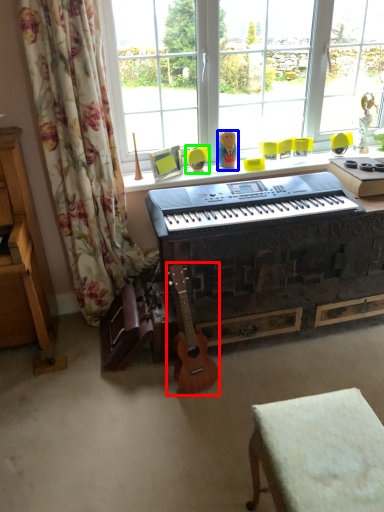
Question: Which object is positioned farthest from guitar (highlighted by a red box)? Select from toy (highlighted by a blue box) and armchair (highlighted by a green box).

Choices:
 (A) toy
 (B) armchair

Answer: (A)